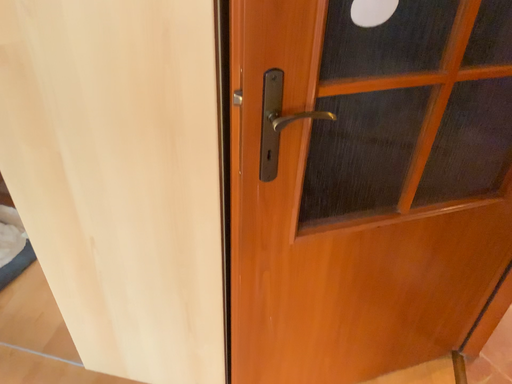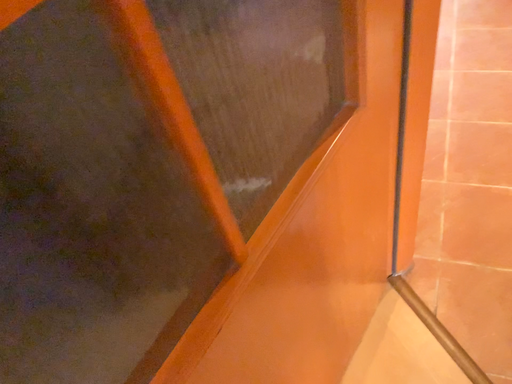
Question: How did the camera likely rotate when shooting the video?

Choices:
 (A) rotated right
 (B) rotated left

Answer: (A)